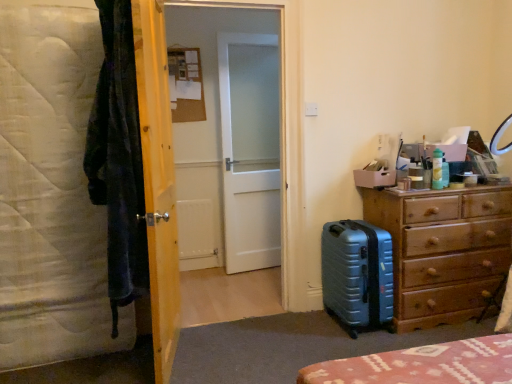
Question: Does metallic blue suitcase at lower right appear on the left side of white quilted mattress at left?

Choices:
 (A) no
 (B) yes

Answer: (A)

Question: From a real-world perspective, is metallic blue suitcase at lower right over white quilted mattress at left?

Choices:
 (A) yes
 (B) no

Answer: (B)

Question: Can you confirm if metallic blue suitcase at lower right is positioned to the right of white quilted mattress at left?

Choices:
 (A) yes
 (B) no

Answer: (A)

Question: Is metallic blue suitcase at lower right taller than white quilted mattress at left?

Choices:
 (A) yes
 (B) no

Answer: (B)

Question: Can you confirm if metallic blue suitcase at lower right is bigger than white quilted mattress at left?

Choices:
 (A) yes
 (B) no

Answer: (B)

Question: Does metallic blue suitcase at lower right have a lesser width compared to white quilted mattress at left?

Choices:
 (A) no
 (B) yes

Answer: (A)

Question: Is green plastic bottle at upper right facing towards white matte screen door at center, which is the first screen door from back to front?

Choices:
 (A) yes
 (B) no

Answer: (B)

Question: From the image's perspective, is green plastic bottle at upper right on top of white matte screen door at center, the second screen door viewed from the front?

Choices:
 (A) no
 (B) yes

Answer: (A)

Question: Can white matte screen door at center, the second screen door viewed from the front, be found inside green plastic bottle at upper right?

Choices:
 (A) yes
 (B) no

Answer: (B)

Question: Is green plastic bottle at upper right to the left of white matte screen door at center, which is the first screen door from back to front, from the viewer's perspective?

Choices:
 (A) no
 (B) yes

Answer: (A)

Question: Is green plastic bottle at upper right far away from white matte screen door at center, the second screen door viewed from the front?

Choices:
 (A) yes
 (B) no

Answer: (A)

Question: Does green plastic bottle at upper right have a lesser height compared to white matte screen door at center, which is the first screen door from back to front?

Choices:
 (A) yes
 (B) no

Answer: (A)

Question: Is green plastic bottle at upper right oriented towards white frosted glass door at center, which appears as the 2th screen door when viewed from the back?

Choices:
 (A) no
 (B) yes

Answer: (A)